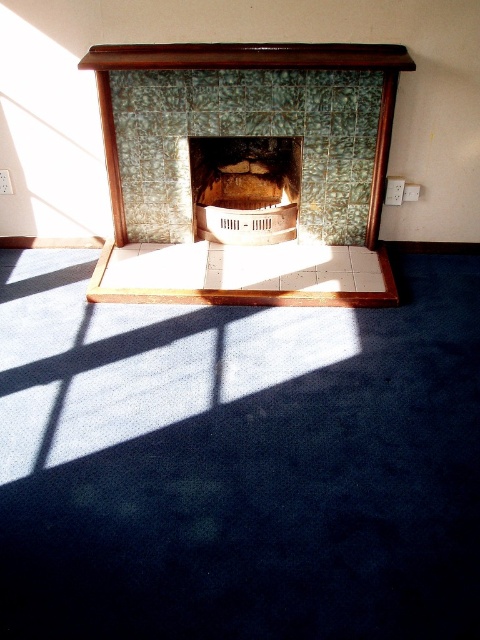
This screenshot has width=480, height=640. Describe the element at coordinates (250, 150) in the screenshot. I see `green textured tile fireplace at center` at that location.

Image resolution: width=480 pixels, height=640 pixels. What are the coordinates of `green textured tile fireplace at center` in the screenshot? It's located at (250, 150).